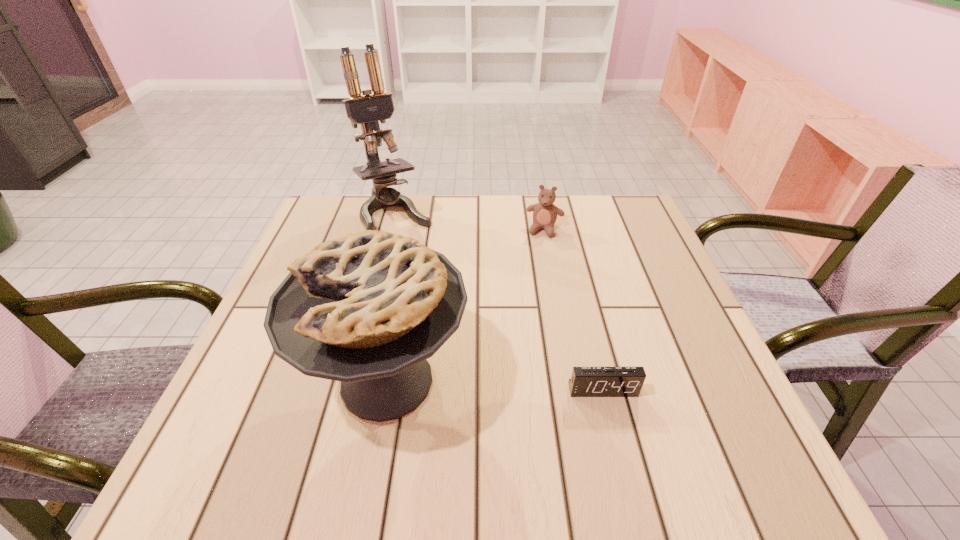
In order to click on object at the near left corner in this screenshot , I will do `click(367, 309)`.

This screenshot has width=960, height=540. I want to click on free spot at the far edge of the desktop, so click(x=573, y=218).

The image size is (960, 540). In order to click on vacant space at the near edge in this screenshot , I will do `click(464, 423)`.

What are the coordinates of `vacant region at the left edge of the desktop` in the screenshot? It's located at (286, 276).

Where is `vacant region at the right edge of the desktop`? The image size is (960, 540). vacant region at the right edge of the desktop is located at coordinates (629, 271).

Locate an element on the screen. This screenshot has height=540, width=960. vacant space at the far left corner of the desktop is located at coordinates (355, 231).

I want to click on vacant point at the far right corner, so click(605, 211).

The height and width of the screenshot is (540, 960). In order to click on vacant point located between the teddy bear and the tallest object in this screenshot , I will do `click(470, 223)`.

The image size is (960, 540). Identify the location of free space between the teddy bear and the alarm clock. (573, 309).

Where is `free space between the alarm clock and the second shortest object`? This screenshot has height=540, width=960. free space between the alarm clock and the second shortest object is located at coordinates (573, 309).